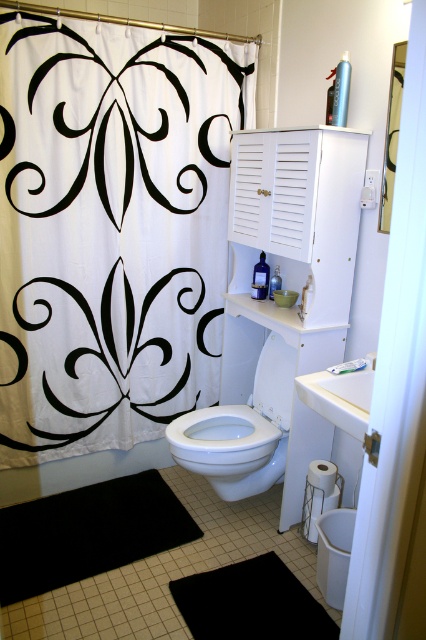
Based on the photo, you are a home decorator planning to hang a new mirror in this bathroom. The mirror is 1.2 meters tall. You want to place it between the white fabric shower curtain at upper left and the black fabric at center. Can the mirror fit vertically between them?

The white fabric shower curtain at upper left is taller than the black fabric at center. Since the mirror is 1.2 meters tall, it can fit vertically between them as long as the vertical space between the two fabrics is at least 1.2 meters. However, the exact placement depends on the actual height difference between the fabrics, which isn

You are standing in the bathroom and need to place a new 10 cm by 10 cm decorative tile. The tile must be placed exactly where the black rubber mat at lower left is currently located. Can you confirm the coordinates to place it?

The black rubber mat at lower left is located at point [88,532], so you should place the decorative tile at those coordinates.